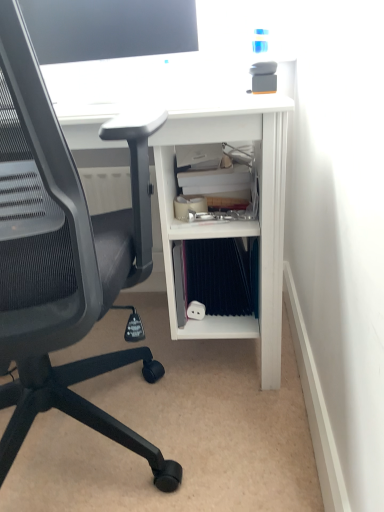
Question: Does black mesh chair at left have a larger size compared to blue fabric binder at lower center?

Choices:
 (A) yes
 (B) no

Answer: (A)

Question: Is blue fabric binder at lower center at the back of black mesh chair at left?

Choices:
 (A) yes
 (B) no

Answer: (B)

Question: Considering the relative sizes of black mesh chair at left and blue fabric binder at lower center in the image provided, is black mesh chair at left wider than blue fabric binder at lower center?

Choices:
 (A) yes
 (B) no

Answer: (A)

Question: From the image's perspective, is black mesh chair at left beneath blue fabric binder at lower center?

Choices:
 (A) yes
 (B) no

Answer: (B)

Question: Is black mesh chair at left at the right side of blue fabric binder at lower center?

Choices:
 (A) yes
 (B) no

Answer: (B)

Question: Is black mesh chair at left beside blue fabric binder at lower center?

Choices:
 (A) yes
 (B) no

Answer: (B)

Question: From a real-world perspective, is blue fabric binder at lower center on top of white matte desk at center?

Choices:
 (A) no
 (B) yes

Answer: (A)

Question: From a real-world perspective, is blue fabric binder at lower center beneath white matte desk at center?

Choices:
 (A) yes
 (B) no

Answer: (A)

Question: Is blue fabric binder at lower center smaller than white matte desk at center?

Choices:
 (A) no
 (B) yes

Answer: (B)

Question: Is white matte desk at center a part of blue fabric binder at lower center?

Choices:
 (A) yes
 (B) no

Answer: (B)

Question: Is blue fabric binder at lower center positioned behind white matte desk at center?

Choices:
 (A) yes
 (B) no

Answer: (A)

Question: Is blue fabric binder at lower center positioned in front of white matte desk at center?

Choices:
 (A) yes
 (B) no

Answer: (B)

Question: Considering the relative sizes of matte black monitor at upper center and blue fabric binder at lower center in the image provided, is matte black monitor at upper center bigger than blue fabric binder at lower center?

Choices:
 (A) no
 (B) yes

Answer: (B)